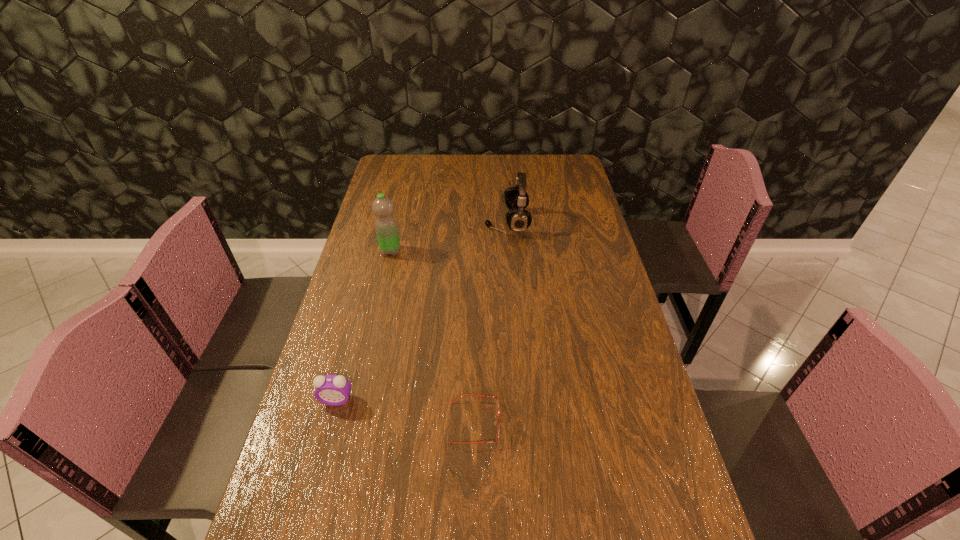
The height and width of the screenshot is (540, 960). I want to click on water bottle that is at the left edge, so (x=386, y=228).

This screenshot has height=540, width=960. What are the coordinates of `alarm clock located in the left edge section of the desktop` in the screenshot? It's located at (334, 390).

In the image, there is a desktop. Identify the location of free space at the far edge. (488, 176).

Identify the location of vacant space at the left edge. (372, 200).

In the image, there is a desktop. What are the coordinates of `free region at the right edge` in the screenshot? It's located at (595, 416).

Identify the location of vacant area at the far left corner of the desktop. The height and width of the screenshot is (540, 960). (406, 178).

This screenshot has width=960, height=540. In order to click on free space at the far right corner of the desktop in this screenshot , I will do `click(541, 174)`.

This screenshot has width=960, height=540. In order to click on free space between the spectacles and the water bottle in this screenshot , I will do (433, 337).

The width and height of the screenshot is (960, 540). I want to click on free space between the shortest object and the alarm clock, so click(x=406, y=411).

Find the location of a particular element. This screenshot has width=960, height=540. free space between the alarm clock and the spectacles is located at coordinates (406, 411).